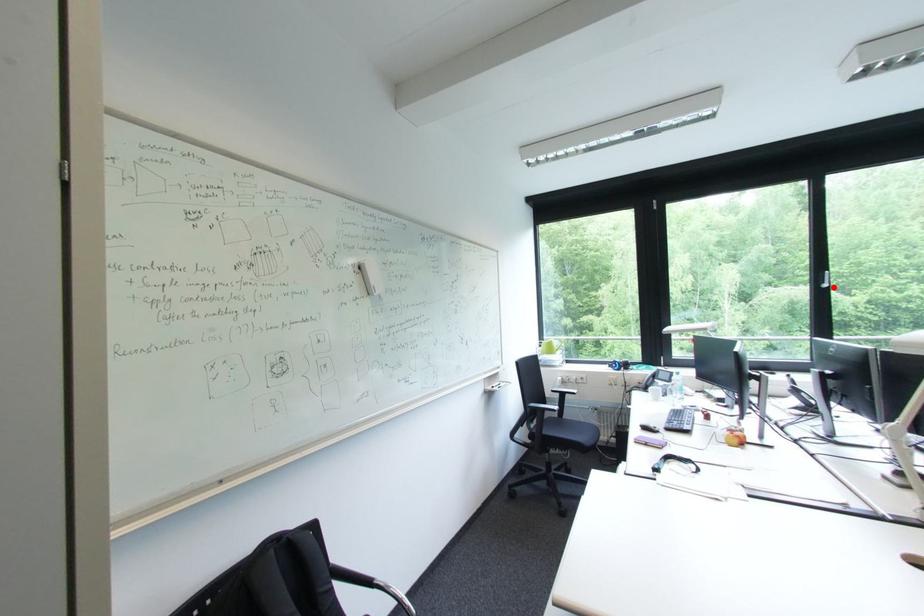
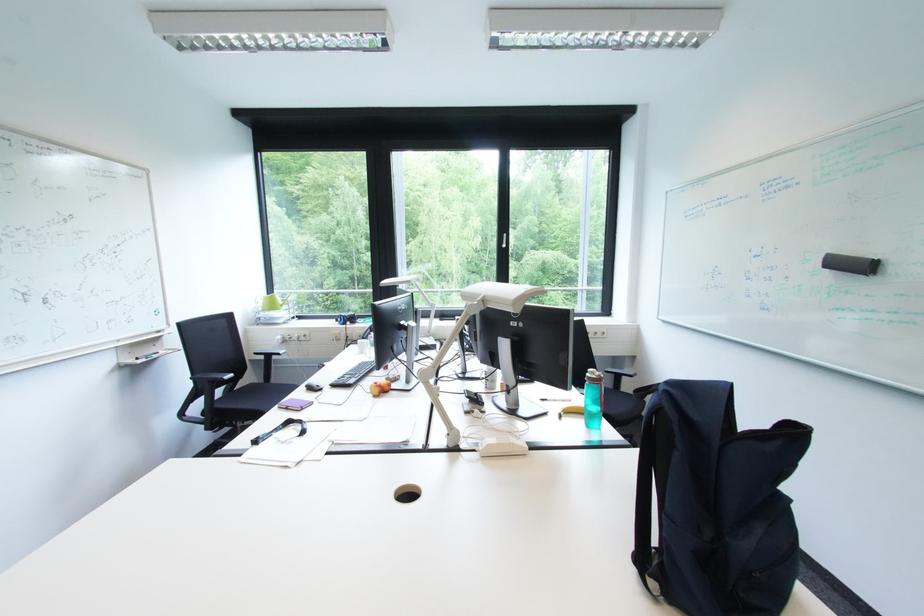
Question: I am providing you with two images of the same scene from different viewpoints. A red point is shown in image1. For the corresponding object point in image2, is it positioned nearer or farther from the camera?

Choices:
 (A) Nearer
 (B) Farther

Answer: (A)